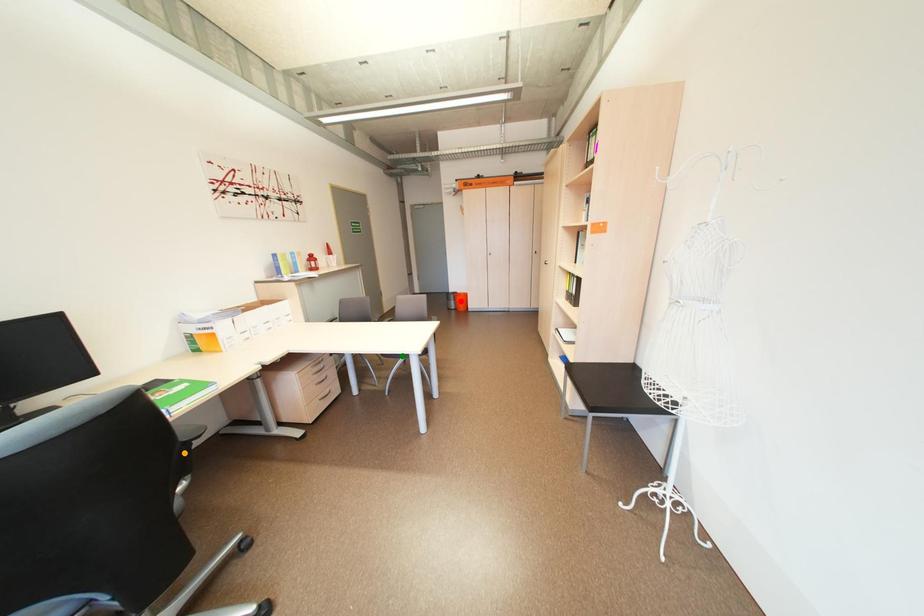
Order these from nearest to farthest:
A) red point
B) green point
C) orange point

orange point < green point < red point